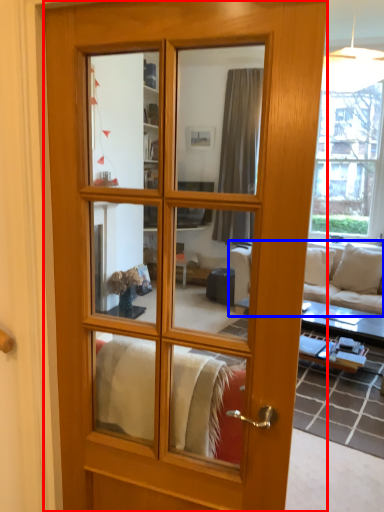
Question: Which of the following is the farthest to the observer, door (highlighted by a red box) or studio couch (highlighted by a blue box)?

Choices:
 (A) door
 (B) studio couch

Answer: (B)